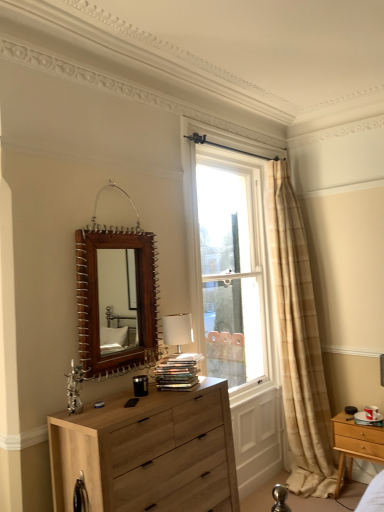
Question: From a real-world perspective, does light wood/texture nightstand at lower right sit lower than natural wood chest of drawers at lower left?

Choices:
 (A) yes
 (B) no

Answer: (A)

Question: Is light wood/texture nightstand at lower right oriented away from natural wood chest of drawers at lower left?

Choices:
 (A) no
 (B) yes

Answer: (A)

Question: Does light wood/texture nightstand at lower right come behind natural wood chest of drawers at lower left?

Choices:
 (A) no
 (B) yes

Answer: (B)

Question: Is light wood/texture nightstand at lower right positioned before natural wood chest of drawers at lower left?

Choices:
 (A) no
 (B) yes

Answer: (A)

Question: From the image's perspective, is light wood/texture nightstand at lower right over natural wood chest of drawers at lower left?

Choices:
 (A) yes
 (B) no

Answer: (B)

Question: Does light wood/texture nightstand at lower right have a greater height compared to natural wood chest of drawers at lower left?

Choices:
 (A) yes
 (B) no

Answer: (B)

Question: From the image's perspective, does beige plaid curtain at right appear higher than brown wooden mirror at upper center?

Choices:
 (A) no
 (B) yes

Answer: (A)

Question: From the image's perspective, would you say beige plaid curtain at right is shown under brown wooden mirror at upper center?

Choices:
 (A) no
 (B) yes

Answer: (B)

Question: From a real-world perspective, is beige plaid curtain at right under brown wooden mirror at upper center?

Choices:
 (A) no
 (B) yes

Answer: (B)

Question: Is beige plaid curtain at right completely or partially outside of brown wooden mirror at upper center?

Choices:
 (A) yes
 (B) no

Answer: (A)

Question: Could brown wooden mirror at upper center be considered to be inside beige plaid curtain at right?

Choices:
 (A) yes
 (B) no

Answer: (B)

Question: Does beige plaid curtain at right lie in front of brown wooden mirror at upper center?

Choices:
 (A) no
 (B) yes

Answer: (A)

Question: Does clear glass window at center appear on the right side of beige plaid curtain at right?

Choices:
 (A) no
 (B) yes

Answer: (A)